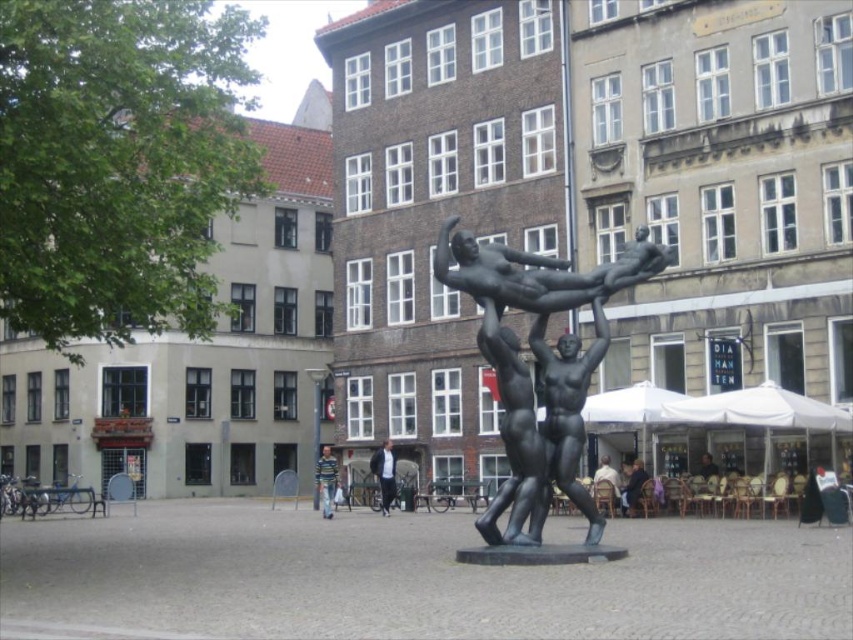
Consider the image. Is bronze statue at center taller than dark blue jacket at center?

Yes.

Does bronze statue at center have a smaller size compared to dark blue jacket at center?

Incorrect, bronze statue at center is not smaller in size than dark blue jacket at center.

Which is behind, point (636, 241) or point (381, 484)?

The point (381, 484) is behind.

You are a GUI agent. You are given a task and a screenshot of the screen. Output one action in this format:
    pyautogui.click(x=<x>, y=<y>)
    Task: Click on the bronze statue at center
    The width and height of the screenshot is (853, 640).
    Given the screenshot: What is the action you would take?
    pyautogui.click(x=538, y=365)

Between dark blue jacket at center and striped sweater at center, which one appears on the left side from the viewer's perspective?

striped sweater at center

Does dark blue jacket at center have a lesser width compared to striped sweater at center?

Correct, dark blue jacket at center's width is less than striped sweater at center's.

Does point (392, 493) come in front of point (322, 490)?

No, (392, 493) is behind (322, 490).

I want to click on dark blue jacket at center, so click(x=384, y=474).

Can you confirm if bronze statue at center is bigger than striped sweater at center?

Yes.

Looking at this image, does bronze statue at center appear on the right side of striped sweater at center?

Indeed, bronze statue at center is positioned on the right side of striped sweater at center.

Measure the distance between point (x=546, y=304) and camera.

35.44 meters

At what (x,y) coordinates should I click in order to perform the action: click on bronze statue at center. Please return your answer as a coordinate pair (x, y). Image resolution: width=853 pixels, height=640 pixels. Looking at the image, I should click on (538, 365).